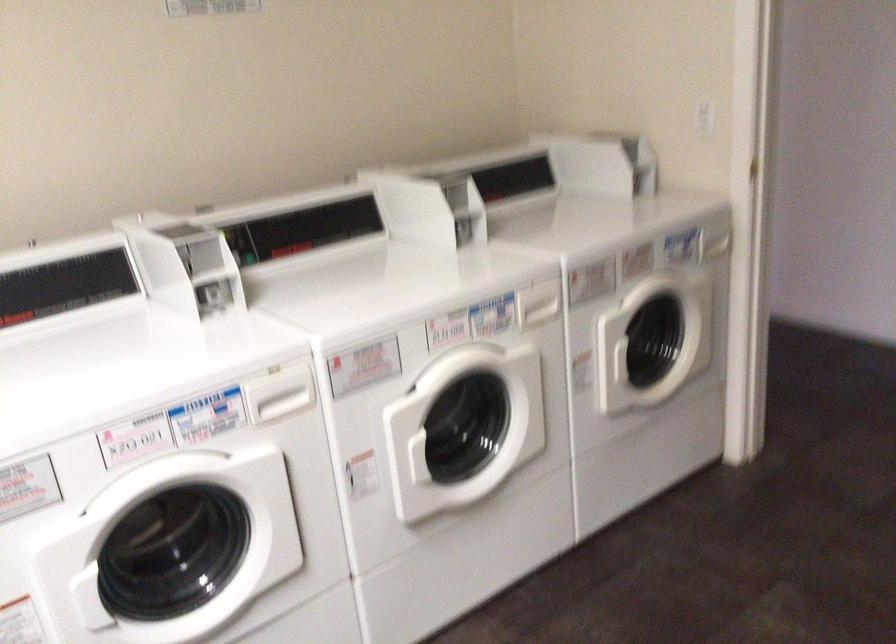
Where would you pull the dispenser drawer handle? Please return your answer as a coordinate pair (x, y).

(279, 393)